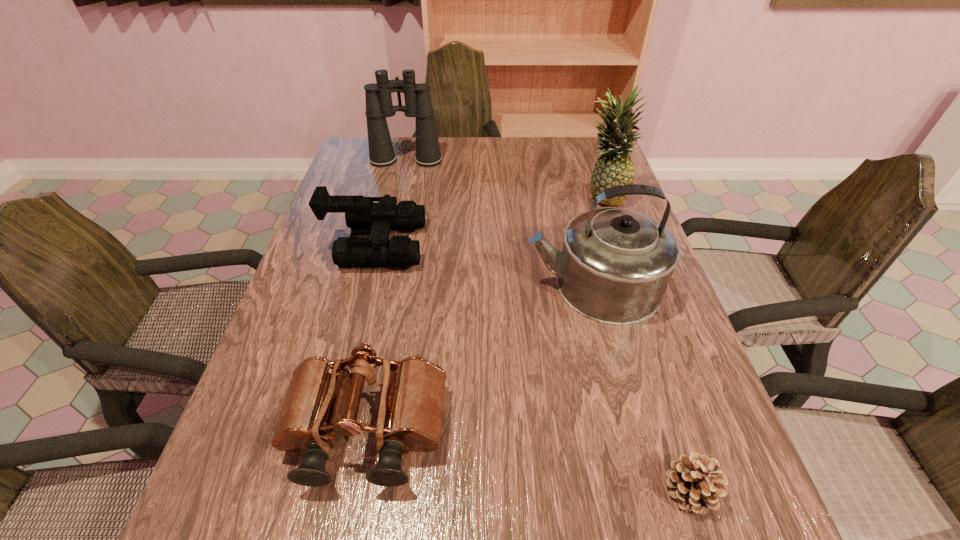
This screenshot has width=960, height=540. In order to click on free region located with the spout at the front of the kettle in this screenshot , I will do pos(472,285).

In order to click on free space located with the spout at the front of the kettle in this screenshot , I will do `click(381, 285)`.

Where is `vacant region located 0.180m on the front lenses of the second nearest binoculars`? Image resolution: width=960 pixels, height=540 pixels. vacant region located 0.180m on the front lenses of the second nearest binoculars is located at coordinates (493, 245).

Where is `blank area located 0.110m on the back of the pinecone`? Image resolution: width=960 pixels, height=540 pixels. blank area located 0.110m on the back of the pinecone is located at coordinates (661, 403).

The image size is (960, 540). I want to click on object positioned at the far edge, so click(418, 104).

Where is `pineapple at the right edge`? The width and height of the screenshot is (960, 540). pineapple at the right edge is located at coordinates (614, 167).

The image size is (960, 540). In order to click on kettle present at the right edge in this screenshot , I will do `click(616, 263)`.

I want to click on pinecone that is at the right edge, so click(694, 481).

Find the location of `object located in the far left corner section of the desktop`. object located in the far left corner section of the desktop is located at coordinates (418, 104).

In the image, there is a desktop. Where is `vacant space at the far edge`? Image resolution: width=960 pixels, height=540 pixels. vacant space at the far edge is located at coordinates (404, 154).